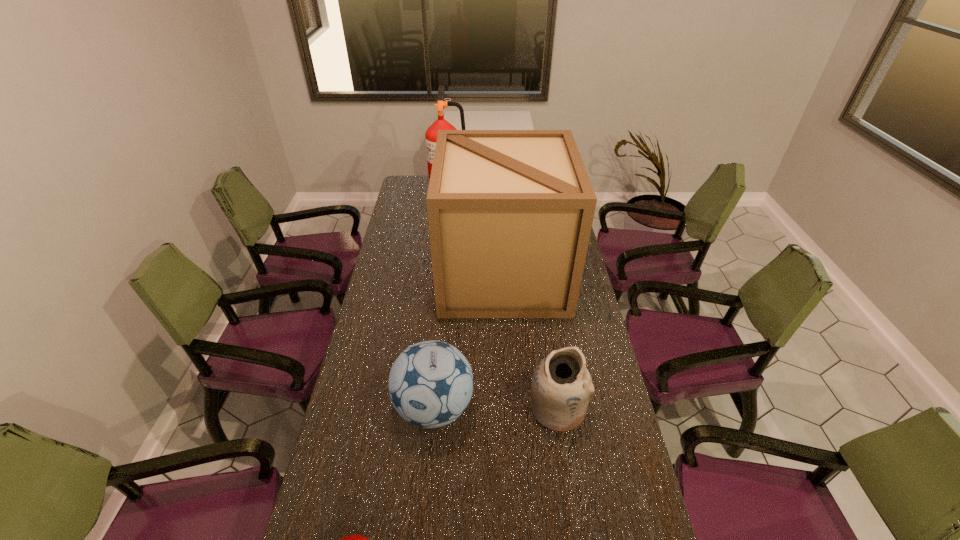
Locate an element on the screen. The width and height of the screenshot is (960, 540). free point between the soccer ball and the fourth nearest object is located at coordinates (468, 341).

Where is `free point between the soccer ball and the fourth nearest object`? This screenshot has height=540, width=960. free point between the soccer ball and the fourth nearest object is located at coordinates (468, 341).

Locate which object ranks fourth in proximity to the soccer ball. Please provide its 2D coordinates. Your answer should be formatted as a tuple, i.e. [(x, y)], where the tuple contains the x and y coordinates of a point satisfying the conditions above.

[(431, 134)]

Select which object appears as the fourth closest to the box. Please provide its 2D coordinates. Your answer should be formatted as a tuple, i.e. [(x, y)], where the tuple contains the x and y coordinates of a point satisfying the conditions above.

[(352, 539)]

At what (x,y) coordinates should I click in order to perform the action: click on vacant region that satisfies the following two spatial constraints: 1. at the nozzle of the pottery; 2. on the left side of the fire extinguisher. Please return your answer as a coordinate pair (x, y). Looking at the image, I should click on (432, 407).

This screenshot has width=960, height=540. I want to click on vacant region that satisfies the following two spatial constraints: 1. on the reinforced sides of the second farthest object; 2. on the back side of the pottery, so click(511, 407).

Locate an element on the screen. free location that satisfies the following two spatial constraints: 1. on the reinforced sides of the pottery; 2. on the right side of the second farthest object is located at coordinates (511, 407).

What are the coordinates of `free spot that satisfies the following two spatial constraints: 1. on the back side of the pottery; 2. on the reinforced sides of the second farthest object` in the screenshot? It's located at (537, 274).

Locate an element on the screen. The image size is (960, 540). free space that satisfies the following two spatial constraints: 1. on the reinforced sides of the second farthest object; 2. on the back side of the pottery is located at coordinates (511, 407).

In order to click on free space that satisfies the following two spatial constraints: 1. at the nozzle of the pottery; 2. on the right side of the fire extinguisher in this screenshot , I will do `click(432, 407)`.